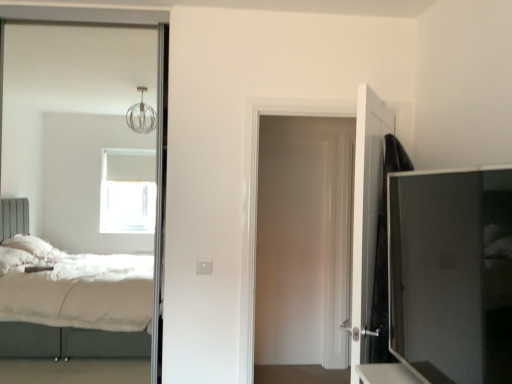
This screenshot has height=384, width=512. Find the location of `vacant area on top of white glossy door at center, which is counted as the first door, starting from the back (from a real-world perspective)`. vacant area on top of white glossy door at center, which is counted as the first door, starting from the back (from a real-world perspective) is located at coordinates coord(317,96).